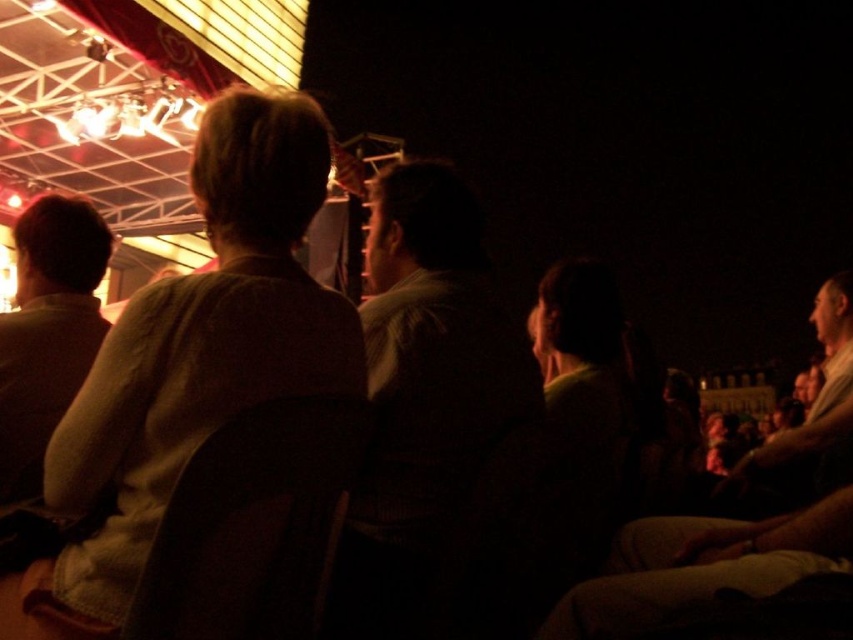
In the theater scene, you notice two light brown items of clothing worn by audience members. The light brown fabric jacket at center and the light brown shirt at left. Which one is positioned to the right of the other?

The light brown fabric jacket at center is positioned to the right of the light brown shirt at left.

You are sitting in the theater and notice two people in front of you wearing a light brown fabric jacket at center and a dark brown sweater at center. Which one is positioned to the left?

The light brown fabric jacket at center is positioned to the left of the dark brown sweater at center.

You are sitting in the theater and want to see the stage clearly. There is a dark brown sweater at center and a light brown shirt at left in front of you. Which clothing item is blocking your view more due to its height?

The dark brown sweater at center is taller than the light brown shirt at left, so it is blocking your view more.